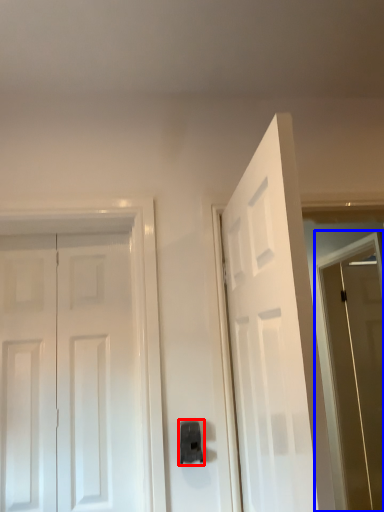
Question: Which point is closer to the camera, door handle (highlighted by a red box) or screen door (highlighted by a blue box)?

Choices:
 (A) door handle
 (B) screen door

Answer: (A)